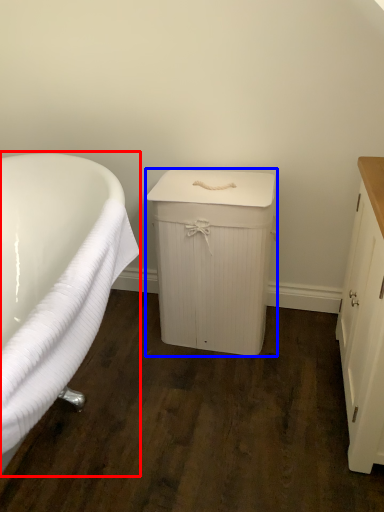
Question: Which point is further to the camera, bathtub (highlighted by a red box) or cabinetry (highlighted by a blue box)?

Choices:
 (A) bathtub
 (B) cabinetry

Answer: (B)